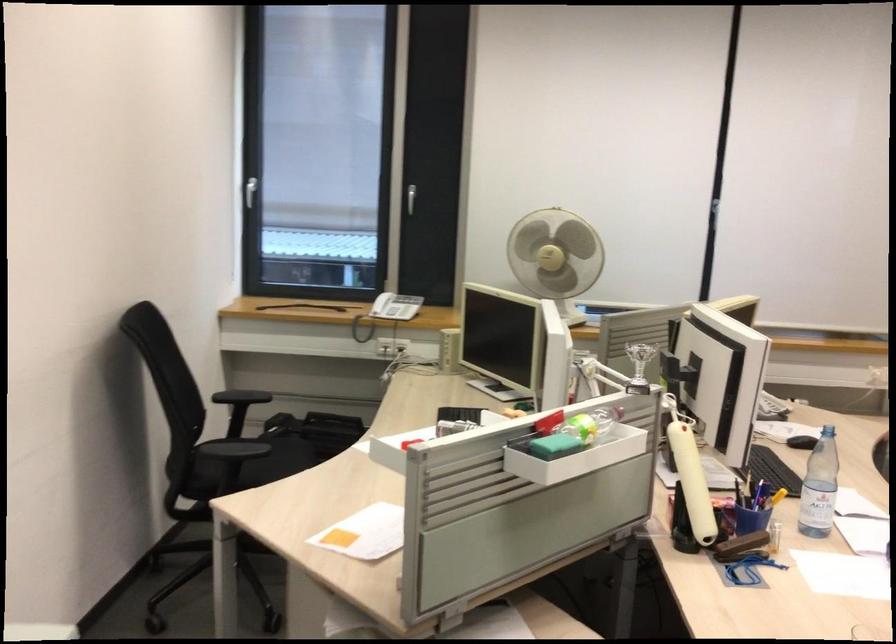
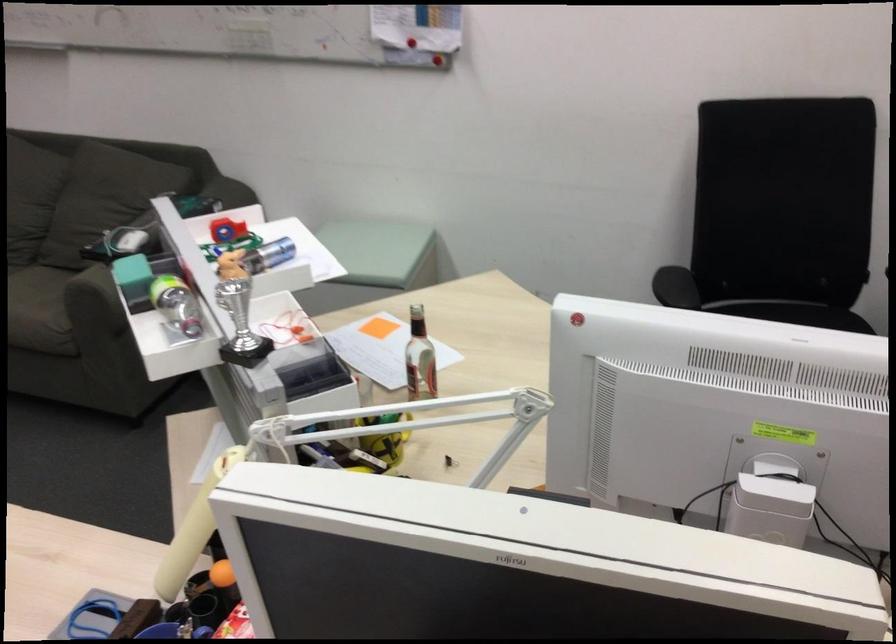
The point at (238, 451) is marked in the first image. Where is the corresponding point in the second image?

(675, 287)